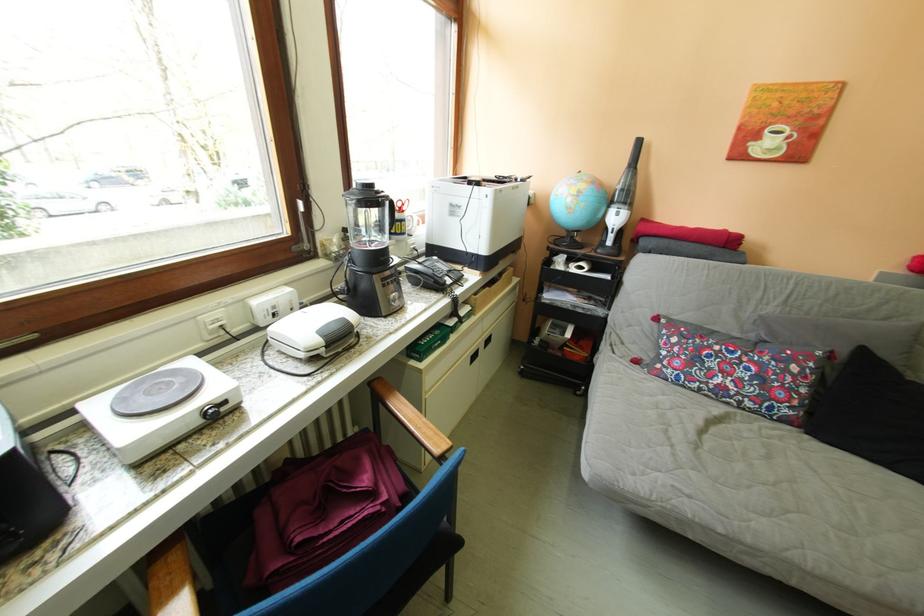
The height and width of the screenshot is (616, 924). Describe the element at coordinates (160, 408) in the screenshot. I see `a printer lid` at that location.